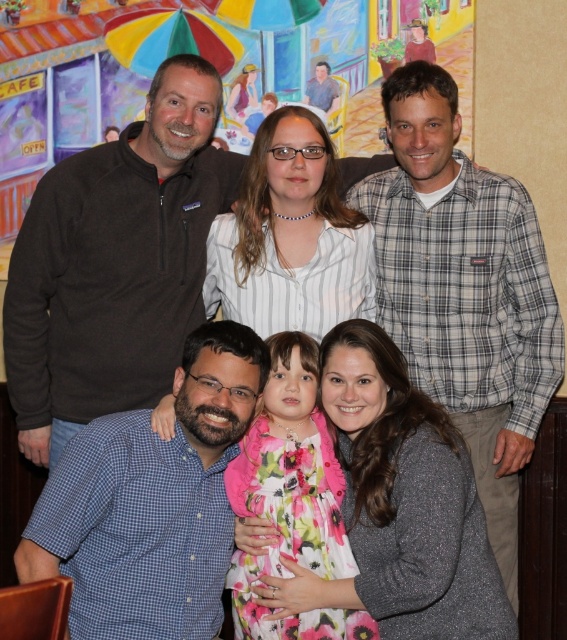
Who is more forward, (155, 92) or (404, 358)?

Point (404, 358)

Where is `dark brown fleece at upper left`? The width and height of the screenshot is (567, 640). dark brown fleece at upper left is located at coordinates (116, 262).

The width and height of the screenshot is (567, 640). I want to click on dark brown fleece at upper left, so coord(116,262).

Find the location of a particular element. blue checkered shirt at lower left is located at coordinates (151, 500).

Can you confirm if blue checkered shirt at lower left is taller than fluffy gray sweater at lower center?

Indeed, blue checkered shirt at lower left has a greater height compared to fluffy gray sweater at lower center.

Is point (221, 387) farther from camera compared to point (393, 435)?

No.

Locate an element on the screen. blue checkered shirt at lower left is located at coordinates (151, 500).

Which is behind, point (280, 188) or point (303, 524)?

The point (280, 188) is more distant.

Does white striped shirt at upper center have a smaller size compared to floral fabric dress at center?

No, white striped shirt at upper center is not smaller than floral fabric dress at center.

Which is behind, point (301, 113) or point (280, 538)?

The point (301, 113) is more distant.

The image size is (567, 640). In order to click on white striped shirt at upper center in this screenshot , I will do `click(290, 237)`.